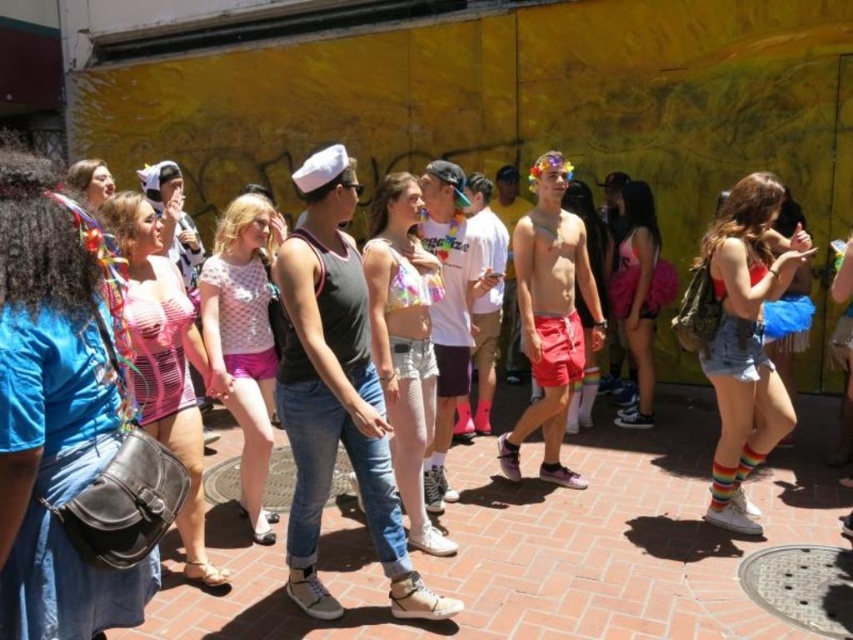
You are standing at the center of the scene and want to find the blue denim shirt at left. Which direction should you look to locate it?

The blue denim shirt at left is located at point 0.650 on the x axis and 0.064 on the y axis. Since you are at the center, you should look to the left side of the scene to find it.

You are organizing a clothing swap event and have two items to display side by side on a mannequin. The blue denim shirt at left and the rainbow fabric bikini top at center. Which clothing item will require more horizontal space on the mannequin?

The rainbow fabric bikini top at center requires more horizontal space on the mannequin because the blue denim shirt at left has a lesser width compared to it.

You are organizing a costume party and need to ensure that all clothing items are displayed properly. The blue denim shirt at left and the rainbow fabric bikini top at center are part of the display. Which clothing item requires a larger display space?

The rainbow fabric bikini top at center requires a larger display space because it is bigger than the blue denim shirt at left.